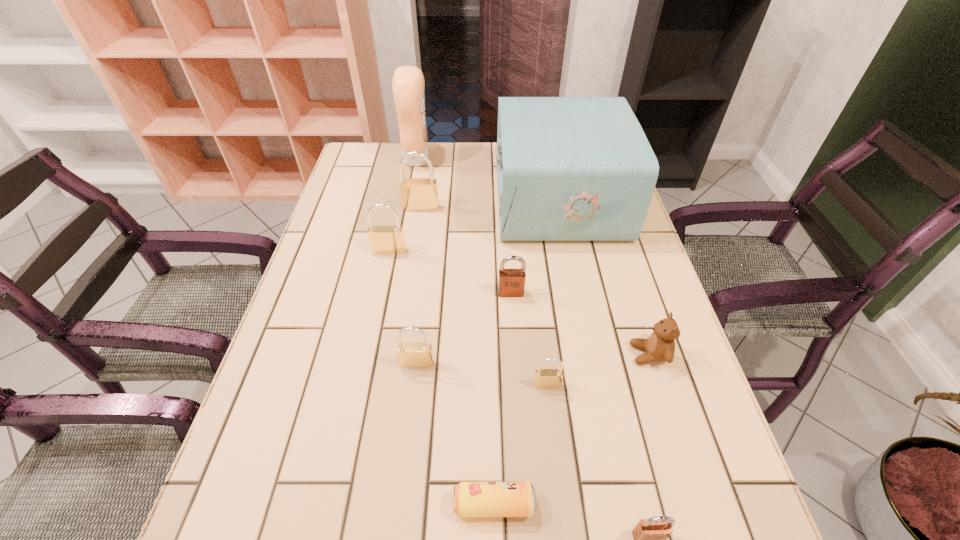
Identify the location of teddy bear. (660, 346).

This screenshot has width=960, height=540. I want to click on the rightmost brass padlock, so click(x=544, y=378).

Where is `the fifth farthest padlock`? Image resolution: width=960 pixels, height=540 pixels. the fifth farthest padlock is located at coordinates (544, 378).

I want to click on beer can, so click(471, 499).

Where is `the ninth farthest object`? Image resolution: width=960 pixels, height=540 pixels. the ninth farthest object is located at coordinates (471, 499).

You are a GUI agent. You are given a task and a screenshot of the screen. Output one action in this format:
    pyautogui.click(x=<x>, y=<y>)
    Task: Click on the vacant space located 0.390m on the label of the condiment
    
    Given the screenshot: What is the action you would take?
    click(550, 160)

Where is `vacant space located on the front panel of the second tallest object`? vacant space located on the front panel of the second tallest object is located at coordinates (397, 200).

At what (x,y) coordinates should I click in order to perform the action: click on vacant space located 0.310m on the front panel of the second tallest object. Please return your answer as a coordinate pair (x, y). The image size is (960, 540). Looking at the image, I should click on (391, 200).

The width and height of the screenshot is (960, 540). In order to click on vacant space located on the front panel of the second tallest object in this screenshot , I will do `click(463, 200)`.

Find the location of a particular element. vacant region located on the front-facing side of the farthest brass padlock is located at coordinates (410, 276).